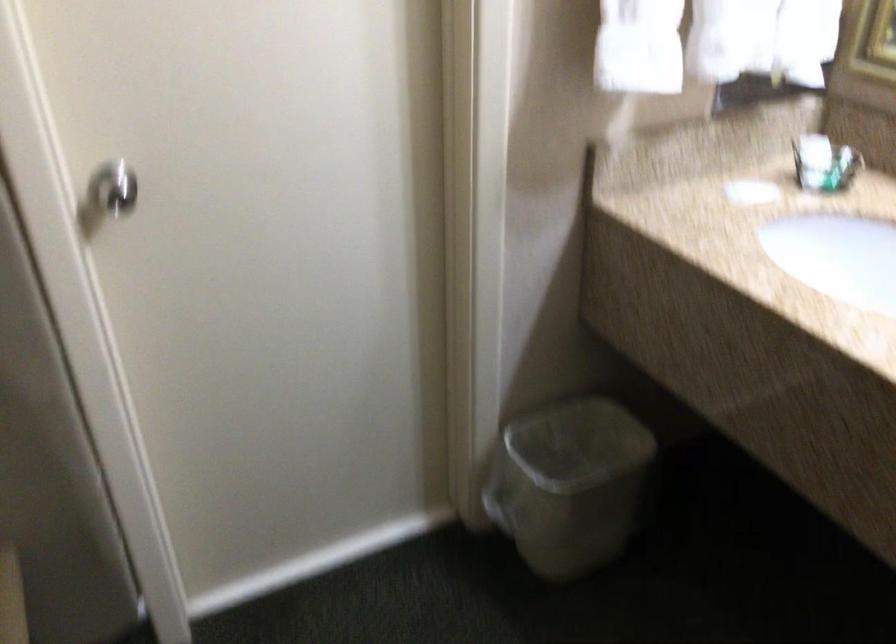
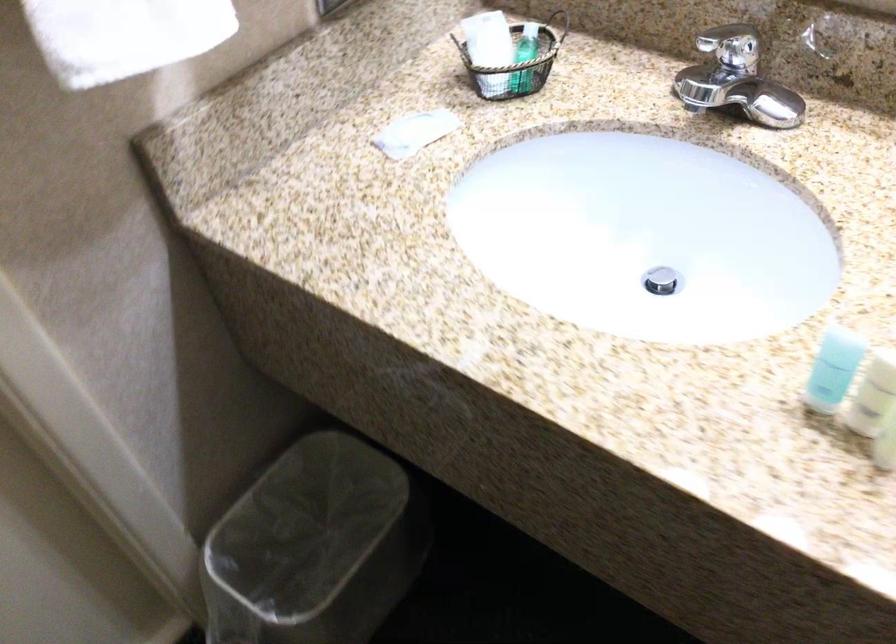
In the second image, find the point that corresponds to point 750,192 in the first image.

(414, 131)